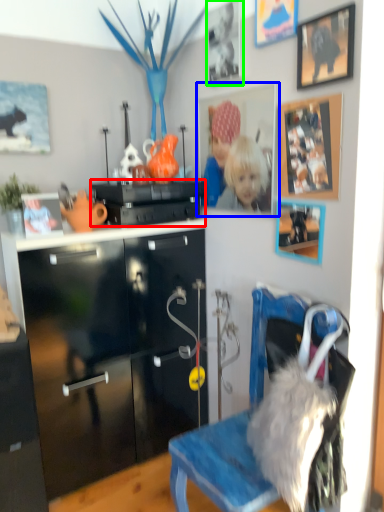
Question: Which object is the farthest from appliance (highlighted by a red box)? Choose among these: picture frame (highlighted by a blue box) or picture frame (highlighted by a green box).

Choices:
 (A) picture frame
 (B) picture frame

Answer: (B)